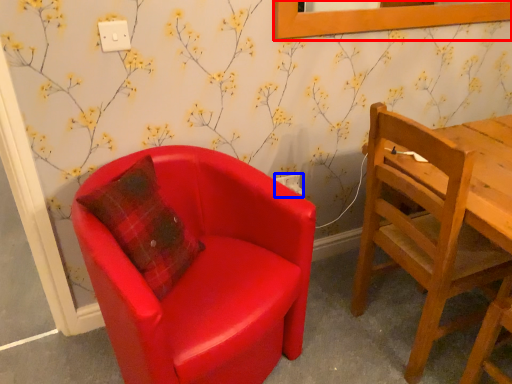
Question: Which point is further to the camera, picture frame (highlighted by a red box) or power outlet (highlighted by a blue box)?

Choices:
 (A) picture frame
 (B) power outlet

Answer: (B)